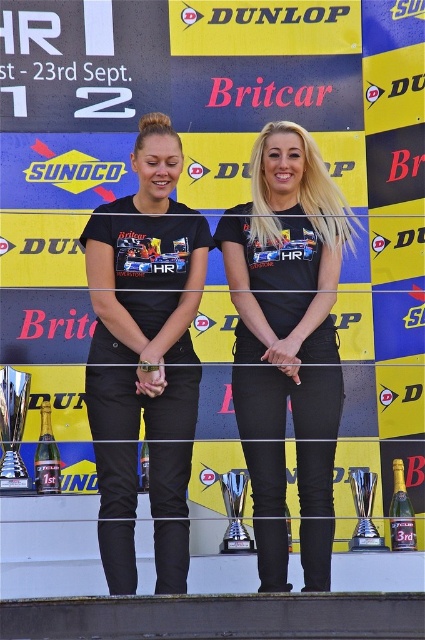
You are a photographer at the event and need to capture a photo where both the black matte pants at center and the shiny silver trophy at center are clearly visible. Based on their positions, which object should you focus on first to ensure both are in frame?

The black matte pants at center is located above the shiny silver trophy at center. To ensure both are in frame, focus on the black matte pants at center first as it is higher up, allowing the trophy below to still be captured within the shot.